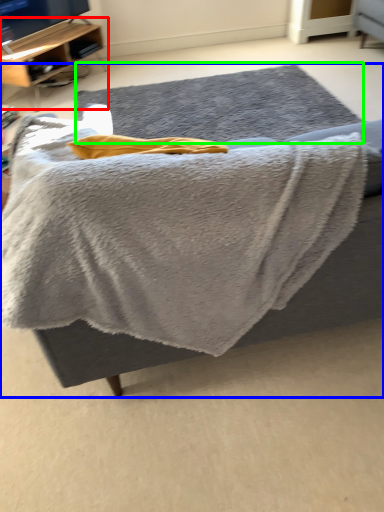
Question: Which object is positioned farthest from shelf (highlighted by a red box)? Select from furniture (highlighted by a blue box) and mat (highlighted by a green box).

Choices:
 (A) furniture
 (B) mat

Answer: (B)